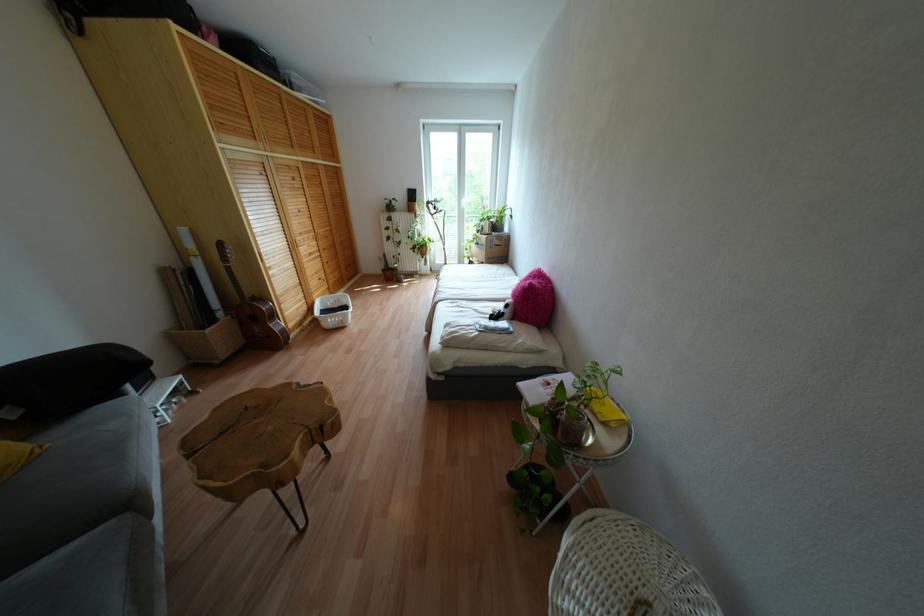
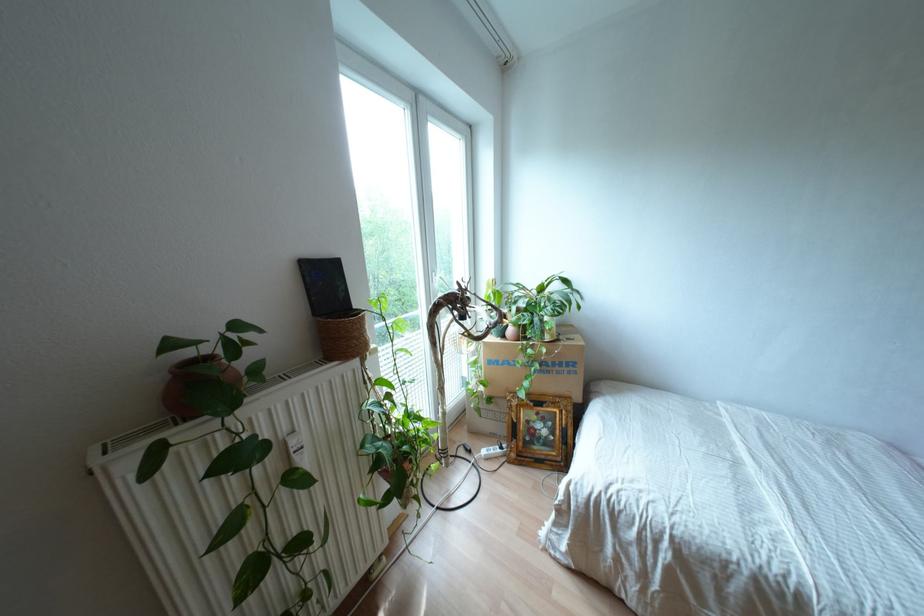
Where in the second image is the point corresponding to pixel 415 190 from the first image?

(334, 262)